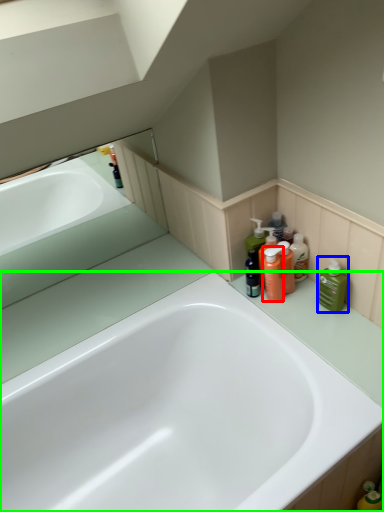
Question: Based on their relative distances, which object is farther from cleaning product (highlighted by a red box)? Choose from cleaning product (highlighted by a blue box) and bathtub (highlighted by a green box).

Choices:
 (A) cleaning product
 (B) bathtub

Answer: (B)